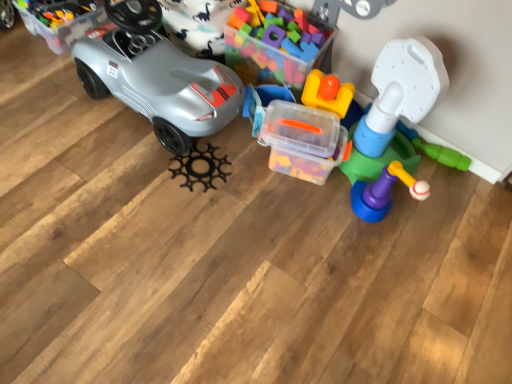
Question: From a real-world perspective, is translucent plastic tower at right, placed as the 4th toy when sorted from left to right, physically above black matte gear at center, which is counted as the first toy, starting from the left?

Choices:
 (A) yes
 (B) no

Answer: (A)

Question: Does translucent plastic tower at right, the first toy from the right, have a lesser height compared to black matte gear at center, positioned as the fourth toy in right-to-left order?

Choices:
 (A) yes
 (B) no

Answer: (B)

Question: Considering the relative sizes of translucent plastic tower at right, placed as the 4th toy when sorted from left to right, and black matte gear at center, positioned as the fourth toy in right-to-left order, in the image provided, is translucent plastic tower at right, placed as the 4th toy when sorted from left to right, smaller than black matte gear at center, positioned as the fourth toy in right-to-left order,?

Choices:
 (A) yes
 (B) no

Answer: (B)

Question: Considering the relative positions of translucent plastic tower at right, placed as the 4th toy when sorted from left to right, and black matte gear at center, positioned as the fourth toy in right-to-left order, in the image provided, is translucent plastic tower at right, placed as the 4th toy when sorted from left to right, behind black matte gear at center, positioned as the fourth toy in right-to-left order,?

Choices:
 (A) yes
 (B) no

Answer: (B)

Question: Is translucent plastic tower at right, the first toy from the right, completely or partially outside of black matte gear at center, positioned as the fourth toy in right-to-left order?

Choices:
 (A) no
 (B) yes

Answer: (B)

Question: In terms of size, does translucent plastic container at center, the third toy viewed from the right, appear bigger or smaller than matte gray car at left?

Choices:
 (A) big
 (B) small

Answer: (B)

Question: Looking at their shapes, would you say translucent plastic container at center, the second toy in the left-to-right sequence, is wider or thinner than matte gray car at left?

Choices:
 (A) thin
 (B) wide

Answer: (A)

Question: Is translucent plastic container at center, the third toy viewed from the right, spatially inside matte gray car at left, or outside of it?

Choices:
 (A) outside
 (B) inside

Answer: (A)

Question: Visually, is translucent plastic container at center, the third toy viewed from the right, positioned to the left or to the right of matte gray car at left?

Choices:
 (A) right
 (B) left

Answer: (A)

Question: In terms of width, does matte gray car at left look wider or thinner when compared to translucent plastic tower at right, placed as the 4th toy when sorted from left to right?

Choices:
 (A) wide
 (B) thin

Answer: (A)

Question: Considering the relative positions of matte gray car at left and translucent plastic tower at right, the first toy from the right, in the image provided, is matte gray car at left to the left or to the right of translucent plastic tower at right, the first toy from the right,?

Choices:
 (A) right
 (B) left

Answer: (B)

Question: Is matte gray car at left bigger or smaller than translucent plastic tower at right, placed as the 4th toy when sorted from left to right?

Choices:
 (A) small
 (B) big

Answer: (B)

Question: Which is correct: matte gray car at left is inside translucent plastic tower at right, placed as the 4th toy when sorted from left to right, or outside of it?

Choices:
 (A) inside
 (B) outside

Answer: (B)

Question: In terms of width, does translucent plastic tower at right, the first toy from the right, look wider or thinner when compared to black matte gear at center, positioned as the fourth toy in right-to-left order?

Choices:
 (A) thin
 (B) wide

Answer: (B)

Question: From the image's perspective, is translucent plastic tower at right, the first toy from the right, located above or below black matte gear at center, which is counted as the first toy, starting from the left?

Choices:
 (A) below
 (B) above

Answer: (B)